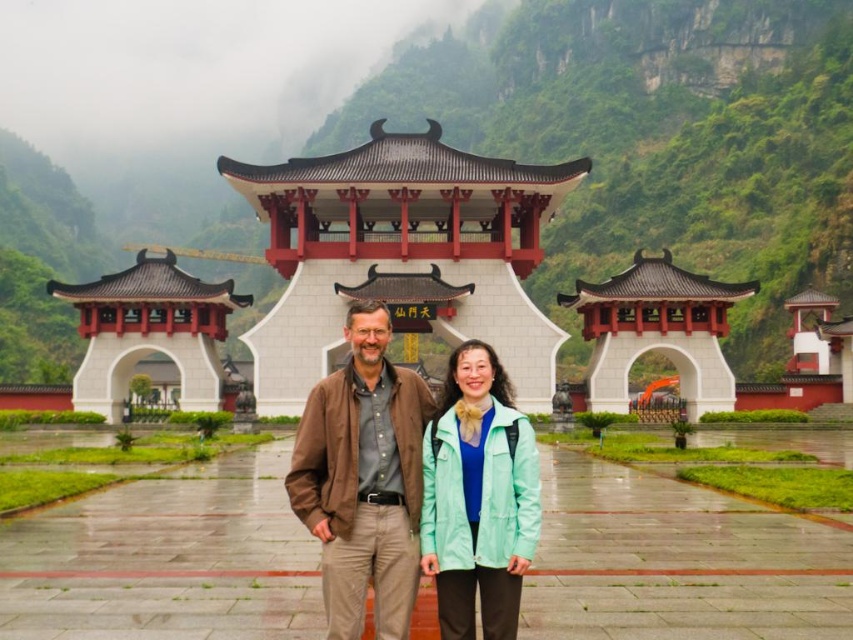
You are a tailor who needs to determine which jacket requires more fabric to alter. Given that you see the brown leather jacket at center and the mint green fabric jacket at center, which one would need more fabric for alterations?

The brown leather jacket at center is larger in size than the mint green fabric jacket at center, so it would require more fabric for alterations.

You are planning to take a photo of the two jackets in front of the temple. Since the temple has a symmetrical archway with golden characters, you want to ensure both jackets are fully visible in the frame. Given that the brown leather jacket at center is taller than the mint green fabric jacket at center, which jacket should be placed closer to the front to avoid blocking the view of the other?

The mint green fabric jacket at center should be placed closer to the front since the brown leather jacket at center is taller. This arrangement will prevent the taller jacket from blocking the view of the shorter one.